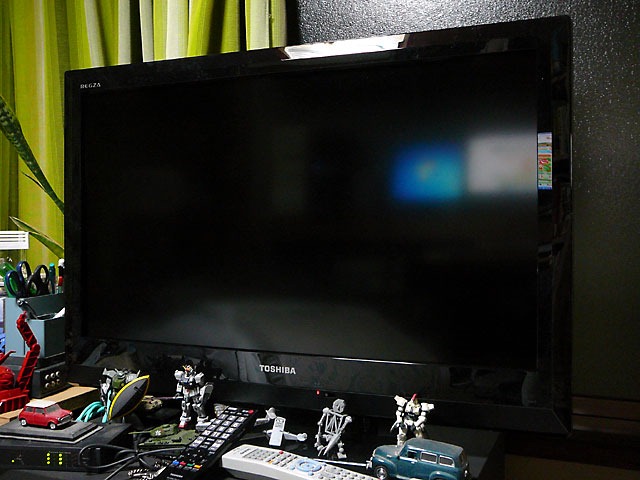
The width and height of the screenshot is (640, 480). In order to click on figurine in this screenshot , I will do `click(412, 409)`, `click(194, 386)`, `click(118, 377)`.